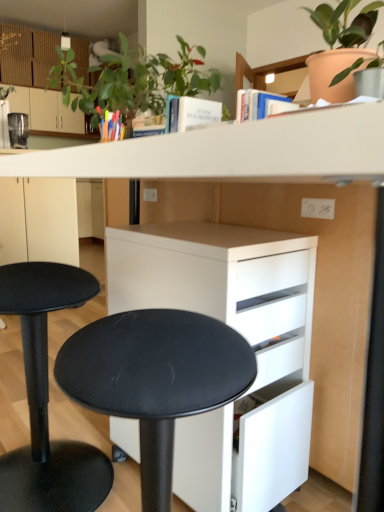
Question: Is black matte stool at lower left at the left side of matte black coffee maker at left?

Choices:
 (A) no
 (B) yes

Answer: (A)

Question: Is the depth of black matte stool at lower left less than that of matte black coffee maker at left?

Choices:
 (A) no
 (B) yes

Answer: (B)

Question: Is black matte stool at lower left outside of matte black coffee maker at left?

Choices:
 (A) yes
 (B) no

Answer: (A)

Question: Are black matte stool at lower left and matte black coffee maker at left located far from each other?

Choices:
 (A) yes
 (B) no

Answer: (A)

Question: Considering the relative sizes of black matte stool at lower left and matte black coffee maker at left in the image provided, is black matte stool at lower left thinner than matte black coffee maker at left?

Choices:
 (A) yes
 (B) no

Answer: (B)

Question: In the image, is white matte cabinet at lower center, the first cabinetry in the front-to-back sequence, positioned in front of or behind matte black coffee maker at left?

Choices:
 (A) behind
 (B) front

Answer: (B)

Question: Considering the positions of white matte cabinet at lower center, the 2th cabinetry viewed from the top, and matte black coffee maker at left in the image, is white matte cabinet at lower center, the 2th cabinetry viewed from the top, bigger or smaller than matte black coffee maker at left?

Choices:
 (A) small
 (B) big

Answer: (B)

Question: In the image, is white matte cabinet at lower center, the 2th cabinetry positioned from the back, on the left side or the right side of matte black coffee maker at left?

Choices:
 (A) left
 (B) right

Answer: (B)

Question: From a real-world perspective, relative to matte black coffee maker at left, is white matte cabinet at lower center, the first cabinetry in the front-to-back sequence, vertically above or below?

Choices:
 (A) below
 (B) above

Answer: (A)

Question: Relative to white matte cabinet at lower center, positioned as the second cabinetry in left-to-right order, is terracotta clay pot at upper right, positioned as the first houseplant in right-to-left order, in front or behind?

Choices:
 (A) behind
 (B) front

Answer: (A)

Question: Is terracotta clay pot at upper right, which is the second houseplant in left-to-right order, taller or shorter than white matte cabinet at lower center, the 2th cabinetry positioned from the back?

Choices:
 (A) short
 (B) tall

Answer: (A)

Question: Is terracotta clay pot at upper right, which is the second houseplant in left-to-right order, inside or outside of white matte cabinet at lower center, the first cabinetry in the front-to-back sequence?

Choices:
 (A) outside
 (B) inside

Answer: (A)

Question: In the image, is terracotta clay pot at upper right, which is the second houseplant in left-to-right order, on the left side or the right side of white matte cabinet at lower center, acting as the 1th cabinetry starting from the right?

Choices:
 (A) left
 (B) right

Answer: (B)

Question: Which is correct: translucent plastic pen holder at upper center is inside white matte cabinet at lower center, the 2th cabinetry positioned from the back, or outside of it?

Choices:
 (A) outside
 (B) inside

Answer: (A)

Question: Based on their sizes in the image, would you say translucent plastic pen holder at upper center is bigger or smaller than white matte cabinet at lower center, the 2th cabinetry viewed from the top?

Choices:
 (A) big
 (B) small

Answer: (B)